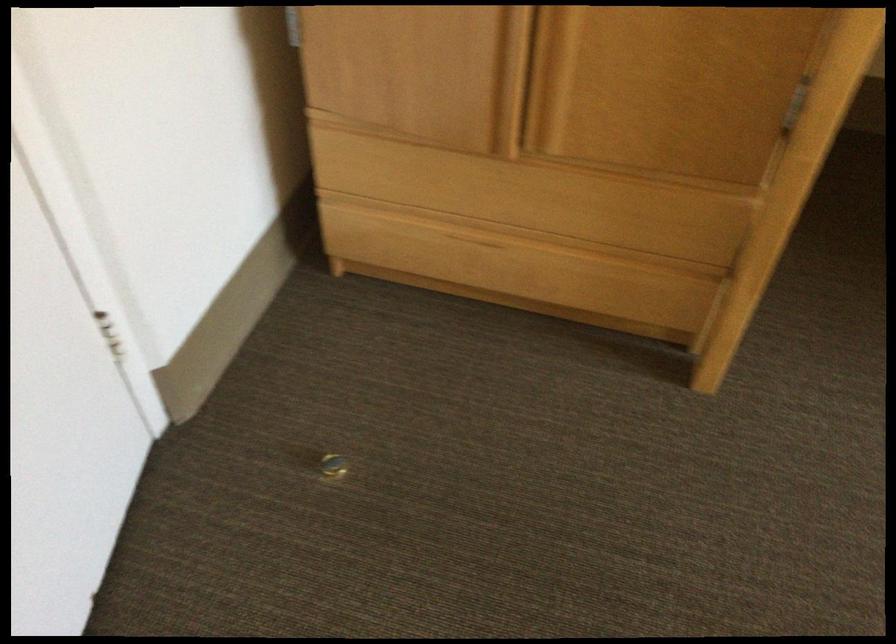
This screenshot has width=896, height=644. Identify the location of small metal cap. (332, 465).